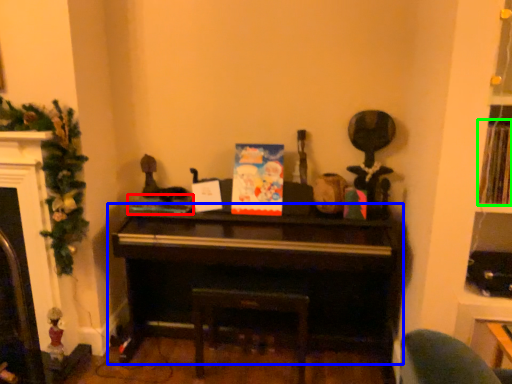
Question: Estimate the real-world distances between objects in this image. Which object is closer to book (highlighted by a red box), piano (highlighted by a blue box) or book (highlighted by a green box)?

Choices:
 (A) piano
 (B) book

Answer: (A)